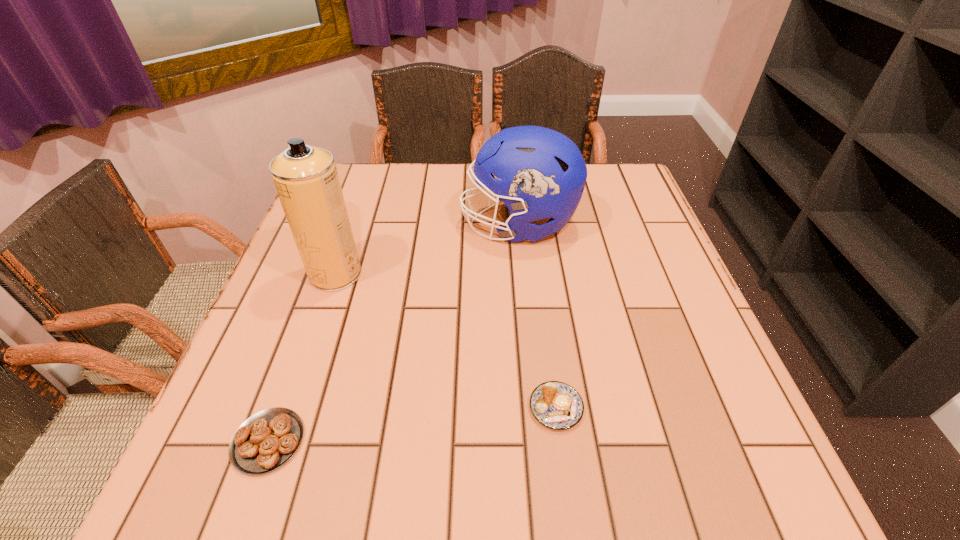
Locate an element on the screen. vacant region that satisfies the following two spatial constraints: 1. on the front-facing side of the second tallest object; 2. on the left side of the right pastry is located at coordinates (538, 408).